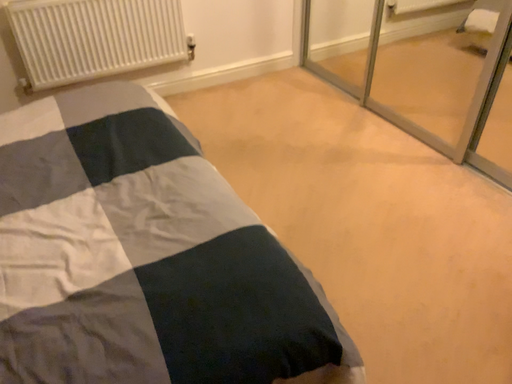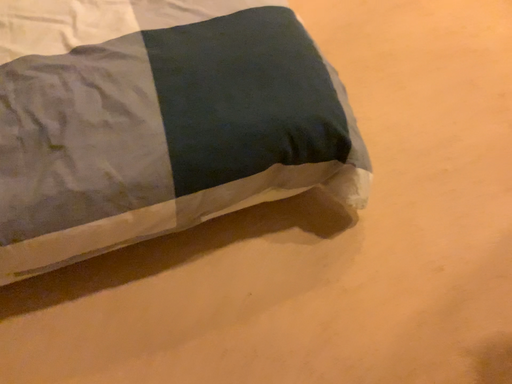
Question: How did the camera likely rotate when shooting the video?

Choices:
 (A) rotated upward
 (B) rotated downward

Answer: (B)